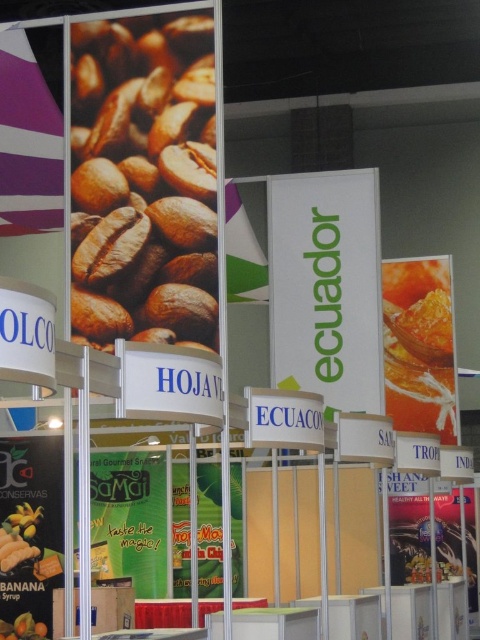
You are standing at the trade show booth for Ecuador and need to locate two specific points marked on the banners. The first point is at coordinate [367,218] and the second is at [8,529]. Which of these points is closer to you as you face the booth?

The point at coordinate [367,218] is closer to you because it is further to the viewer than the point at [8,529].

You are at the Ecuador exhibition booth and want to compare the height of the green paper sign at center and the shiny orange honeycomb at right. Which one is taller?

The shiny orange honeycomb at right is taller than the green paper sign at center.